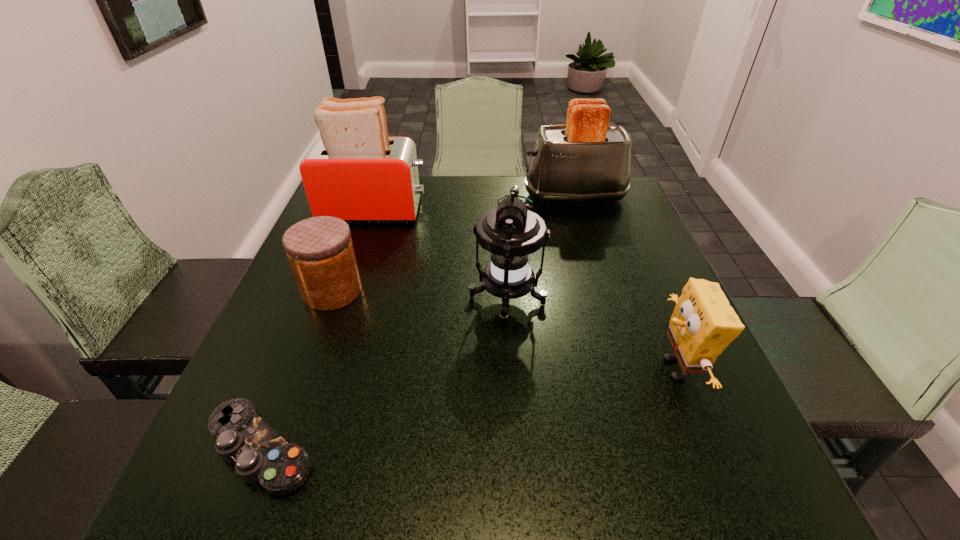
Locate an element on the screen. Image resolution: width=960 pixels, height=540 pixels. vacant region located on the front of the lantern is located at coordinates (512, 366).

This screenshot has width=960, height=540. Identify the location of vacant region located 0.230m on the face of the sponge. (526, 368).

The height and width of the screenshot is (540, 960). Identify the location of vacant space positioned on the face of the sponge. (570, 368).

In order to click on vacant point located 0.280m on the face of the sponge in this screenshot , I will do `click(498, 368)`.

Image resolution: width=960 pixels, height=540 pixels. In order to click on free space located 0.350m on the right of the jar in this screenshot , I will do [524, 291].

Locate an element on the screen. The height and width of the screenshot is (540, 960). vacant point located 0.360m on the back of the shortest object is located at coordinates pos(332,268).

Where is `object that is positioned at the near edge`? object that is positioned at the near edge is located at coordinates (261, 455).

Locate an element on the screen. The image size is (960, 540). toaster positioned at the left edge is located at coordinates (354, 171).

Locate an element on the screen. jar located at the left edge is located at coordinates (320, 251).

Find the location of a particular element. control positioned at the left edge is located at coordinates (261, 455).